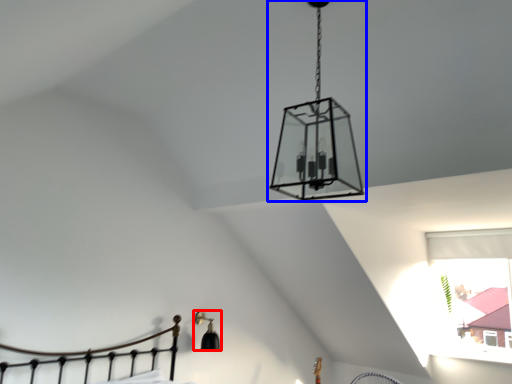
Question: Which object is further to the camera taking this photo, lamp (highlighted by a red box) or lamp (highlighted by a blue box)?

Choices:
 (A) lamp
 (B) lamp

Answer: (A)